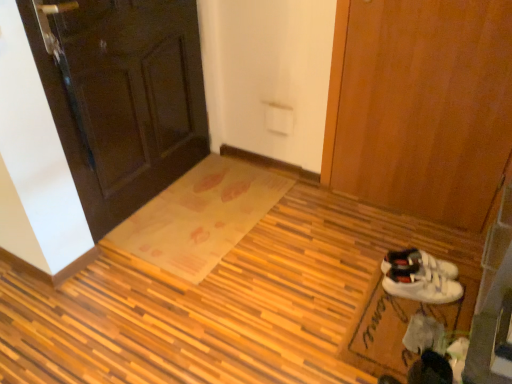
Identify the location of vacant space situated on the left part of white suede sneakers at lower right. The width and height of the screenshot is (512, 384). (375, 309).